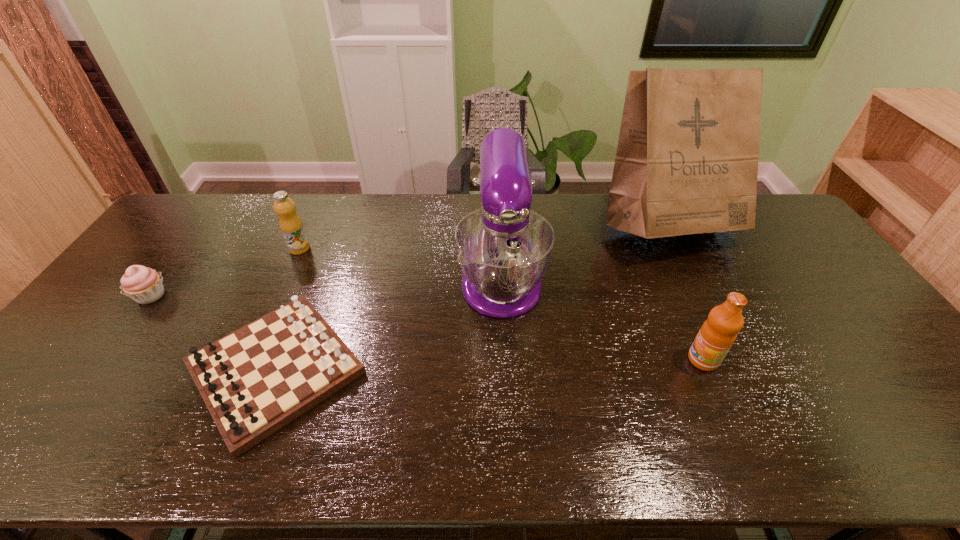
In order to click on blank space at the far edge in this screenshot , I will do click(254, 219).

The width and height of the screenshot is (960, 540). I want to click on vacant space at the left edge, so click(205, 239).

In the image, there is a desktop. Where is `free space at the right edge`? The width and height of the screenshot is (960, 540). free space at the right edge is located at coordinates (912, 409).

This screenshot has width=960, height=540. In the image, there is a desktop. Identify the location of vacant region at the far left corner. (184, 218).

You are a GUI agent. You are given a task and a screenshot of the screen. Output one action in this format:
    pyautogui.click(x=<x>, y=<y>)
    Task: Click on the free region at the near right corner of the desktop
    This screenshot has width=960, height=540.
    Given the screenshot: What is the action you would take?
    pyautogui.click(x=928, y=447)

Locate an element on the screen. The height and width of the screenshot is (540, 960). empty space that is in between the cupcake and the nearer fruit juice is located at coordinates (427, 328).

This screenshot has height=540, width=960. I want to click on vacant area that lies between the leftmost object and the nearer fruit juice, so point(427,328).

Find the location of `free space between the left fruit juice and the leftmost object`. free space between the left fruit juice and the leftmost object is located at coordinates (226, 272).

Identify the location of free point between the right fruit juice and the grocery bag. The width and height of the screenshot is (960, 540). (684, 294).

Locate an element on the screen. The width and height of the screenshot is (960, 540). free space between the fourth object from left to right and the grocery bag is located at coordinates (584, 252).